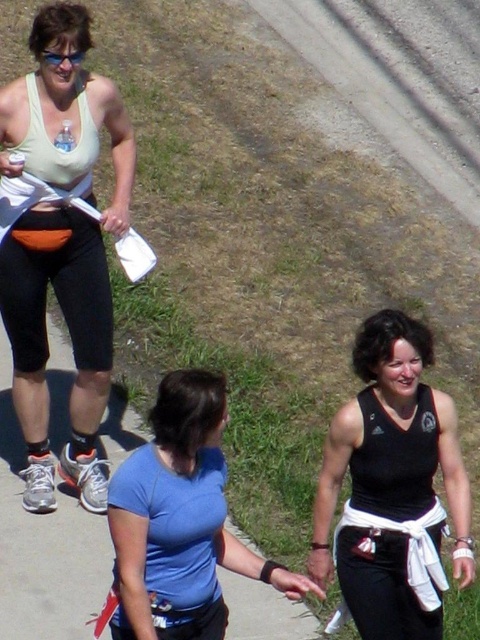
Question: Does blue fabric shirt at center come behind clear plastic goggles at upper left?

Choices:
 (A) no
 (B) yes

Answer: (A)

Question: Does black matte tank top at lower right have a smaller size compared to blue fabric shirt at center?

Choices:
 (A) no
 (B) yes

Answer: (A)

Question: Which object is the farthest from the blue fabric shirt at center?

Choices:
 (A) matte white tank top at upper left
 (B) clear plastic goggles at upper left

Answer: (B)

Question: Among these points, which one is farthest from the camera?

Choices:
 (A) coord(166,573)
 (B) coord(39,56)

Answer: (B)

Question: Is blue fabric shirt at center below clear plastic goggles at upper left?

Choices:
 (A) yes
 (B) no

Answer: (A)

Question: Which of the following is the farthest from the observer?

Choices:
 (A) blue fabric shirt at center
 (B) matte white tank top at upper left
 (C) clear plastic goggles at upper left
 (D) black matte tank top at lower right

Answer: (C)